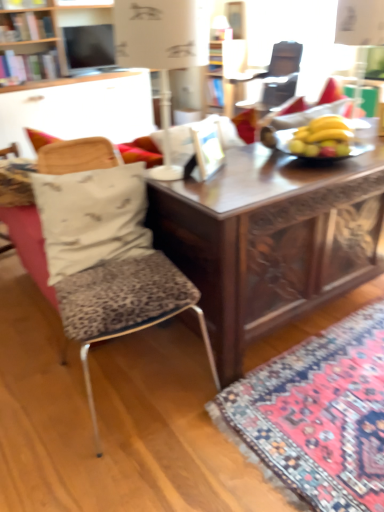
Where is `free spot to the right of wooden picture frame at center`? Image resolution: width=384 pixels, height=512 pixels. free spot to the right of wooden picture frame at center is located at coordinates (252, 165).